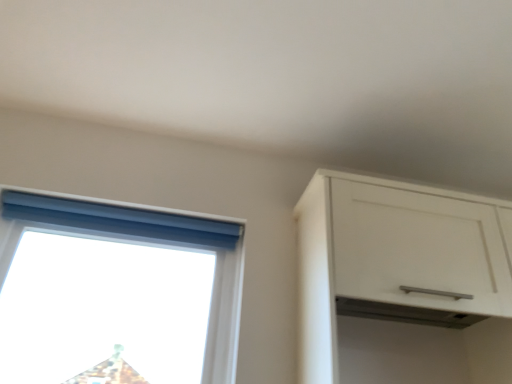
Question: Is transparent plastic window at upper left smaller than blue fabric curtain at upper left?

Choices:
 (A) yes
 (B) no

Answer: (B)

Question: Is transparent plastic window at upper left far from blue fabric curtain at upper left?

Choices:
 (A) no
 (B) yes

Answer: (A)

Question: Does transparent plastic window at upper left appear on the left side of blue fabric curtain at upper left?

Choices:
 (A) no
 (B) yes

Answer: (B)

Question: Can we say transparent plastic window at upper left lies outside blue fabric curtain at upper left?

Choices:
 (A) no
 (B) yes

Answer: (B)

Question: Does transparent plastic window at upper left have a greater width compared to blue fabric curtain at upper left?

Choices:
 (A) yes
 (B) no

Answer: (A)

Question: Would you say white matte cabinet at upper right is to the left or to the right of blue fabric curtain at upper left in the picture?

Choices:
 (A) right
 (B) left

Answer: (A)

Question: From their relative heights in the image, would you say white matte cabinet at upper right is taller or shorter than blue fabric curtain at upper left?

Choices:
 (A) tall
 (B) short

Answer: (A)

Question: In terms of size, does white matte cabinet at upper right appear bigger or smaller than blue fabric curtain at upper left?

Choices:
 (A) big
 (B) small

Answer: (A)

Question: From a real-world perspective, is white matte cabinet at upper right positioned above or below blue fabric curtain at upper left?

Choices:
 (A) above
 (B) below

Answer: (B)

Question: From a real-world perspective, is transparent plastic window at upper left physically located above or below blue fabric curtain at upper left?

Choices:
 (A) above
 (B) below

Answer: (B)

Question: Considering the positions of transparent plastic window at upper left and blue fabric curtain at upper left in the image, is transparent plastic window at upper left taller or shorter than blue fabric curtain at upper left?

Choices:
 (A) tall
 (B) short

Answer: (A)

Question: Is transparent plastic window at upper left inside the boundaries of blue fabric curtain at upper left, or outside?

Choices:
 (A) inside
 (B) outside

Answer: (B)

Question: Considering their positions, is transparent plastic window at upper left located in front of or behind blue fabric curtain at upper left?

Choices:
 (A) front
 (B) behind

Answer: (A)

Question: Would you say blue fabric curtain at upper left is inside or outside white matte cabinet at upper right?

Choices:
 (A) outside
 (B) inside

Answer: (A)

Question: Is point (112, 213) closer or farther from the camera than point (501, 241)?

Choices:
 (A) closer
 (B) farther

Answer: (B)